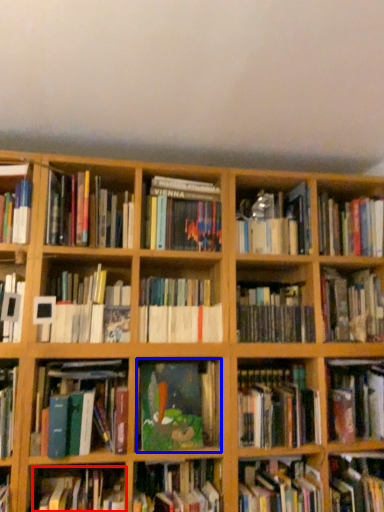
Question: Which of the following is the farthest to the observer, book (highlighted by a red box) or book (highlighted by a blue box)?

Choices:
 (A) book
 (B) book

Answer: (B)